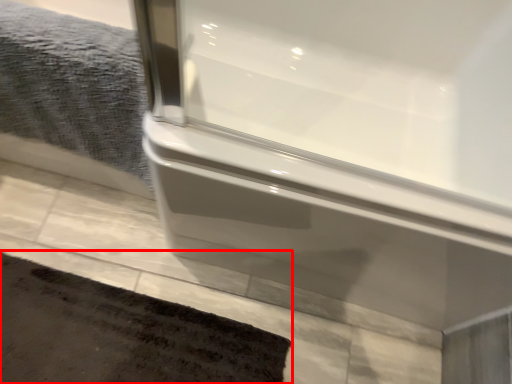
Question: Considering the relative positions of bath mat (annotated by the red box) and bath towel in the image provided, where is bath mat (annotated by the red box) located with respect to the staircase?

Choices:
 (A) right
 (B) left

Answer: (A)